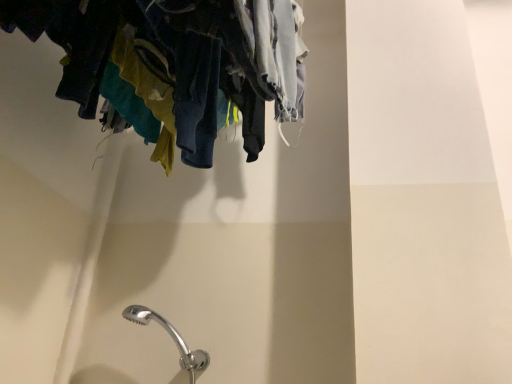
This screenshot has height=384, width=512. Find the location of `dark fabric clothes at upper left`. dark fabric clothes at upper left is located at coordinates (175, 65).

Describe the element at coordinates (175, 65) in the screenshot. The image size is (512, 384). I see `dark fabric clothes at upper left` at that location.

Locate an element on the screen. dark fabric clothes at upper left is located at coordinates (175, 65).